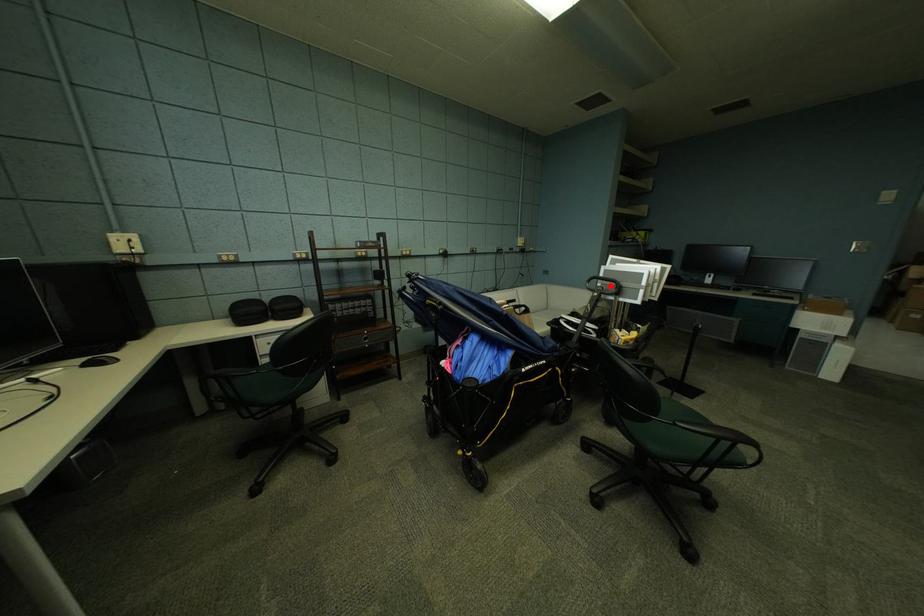
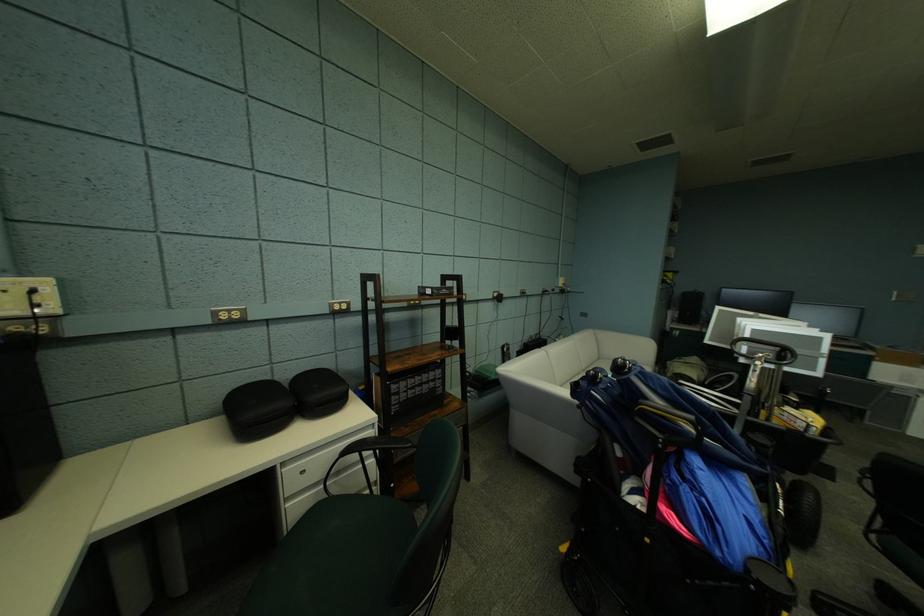
Question: I am providing you with two images of the same scene from different viewpoints. A red point is marked on the first image. At the location where the point appears in image 1, is it still visible in image 2?

Choices:
 (A) Yes
 (B) No

Answer: (A)